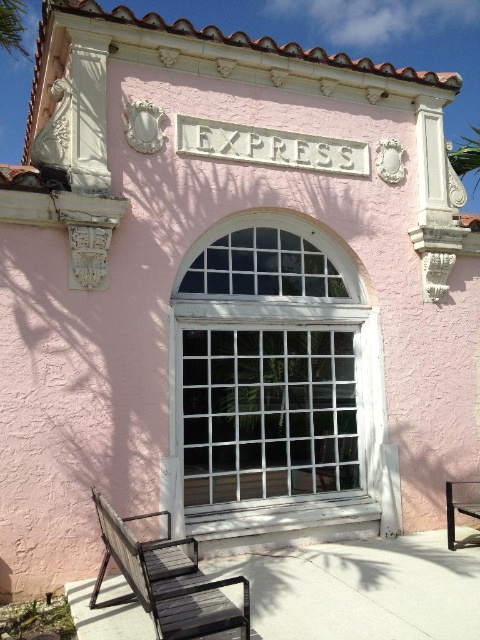
Is wooden park bench at lower left smaller than wooden bench at lower right?

Actually, wooden park bench at lower left might be larger than wooden bench at lower right.

Does wooden park bench at lower left appear on the left side of wooden bench at lower right?

Indeed, wooden park bench at lower left is positioned on the left side of wooden bench at lower right.

Who is more forward, (94, 588) or (452, 499)?

Positioned in front is point (94, 588).

The width and height of the screenshot is (480, 640). Identify the location of wooden park bench at lower left. [x=167, y=580].

Which of these two, white glass window at center or wooden bench at lower right, stands taller?

Standing taller between the two is white glass window at center.

Which is more to the right, white glass window at center or wooden bench at lower right?

Positioned to the right is wooden bench at lower right.

Does point (224, 428) come in front of point (446, 515)?

Yes, point (224, 428) is closer to viewer.

Locate an element on the screen. Image resolution: width=480 pixels, height=640 pixels. white glass window at center is located at coordinates (269, 381).

Can you confirm if white glass window at center is bigger than wooden park bench at lower left?

Indeed, white glass window at center has a larger size compared to wooden park bench at lower left.

Which is in front, point (279, 524) or point (182, 618)?

Point (182, 618)

Locate an element on the screen. white glass window at center is located at coordinates point(269,381).